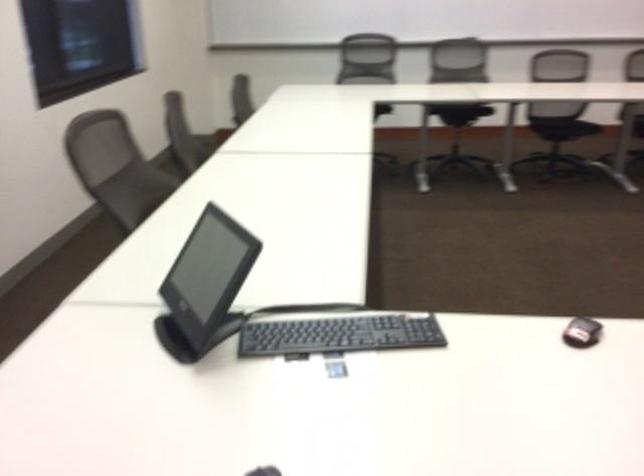
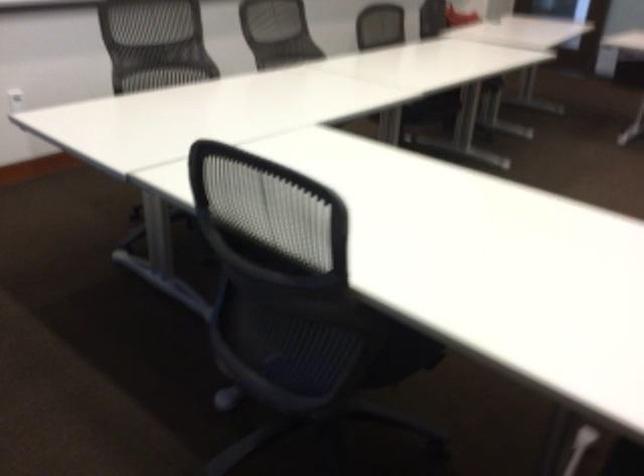
Based on the continuous images, in which direction is the camera rotating?

The camera rotated toward right-down.